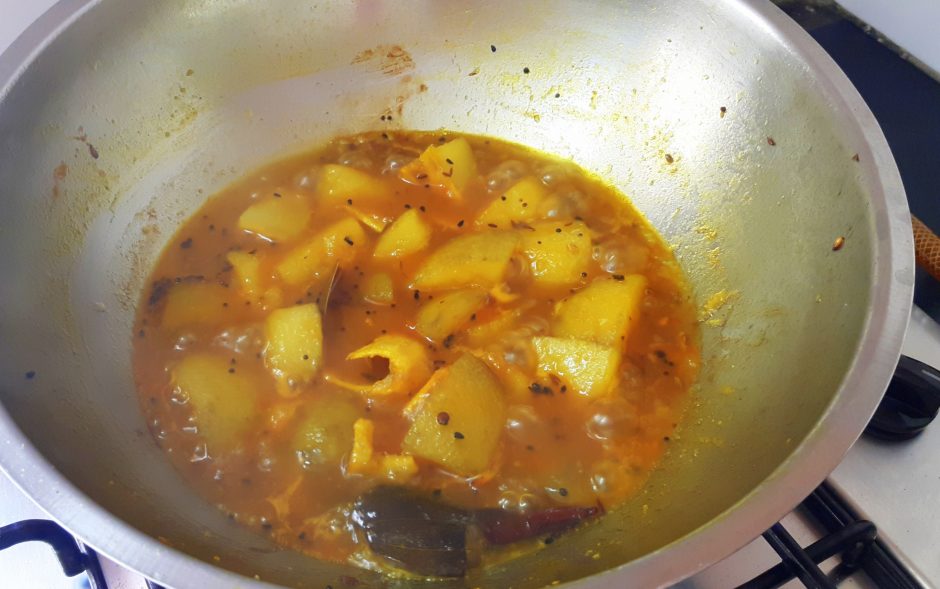
Find the location of a particular element. This screenshot has height=589, width=940. bowl is located at coordinates (483, 72).